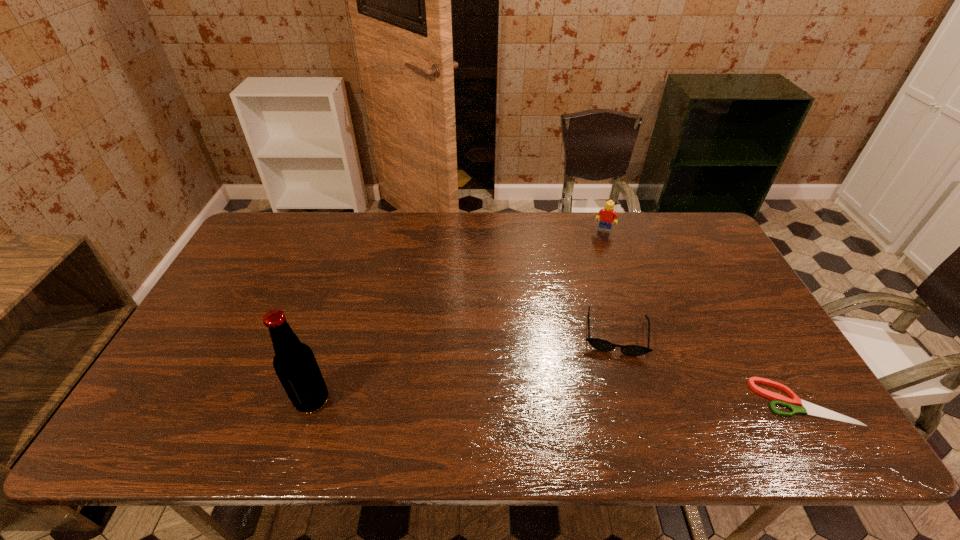
Locate an element on the screen. This screenshot has width=960, height=540. vacant space that is in between the third tallest object and the Lego is located at coordinates (610, 281).

Image resolution: width=960 pixels, height=540 pixels. Identify the location of free point between the beer bottle and the rightmost object. (558, 401).

Find the location of a particular element. The image size is (960, 540). unoccupied position between the Lego and the sunglasses is located at coordinates (610, 281).

Find the location of a particular element. free space between the scissors and the Lego is located at coordinates (704, 316).

This screenshot has width=960, height=540. I want to click on free space between the second tallest object and the third tallest object, so click(x=610, y=281).

Identify the location of the third closest object relative to the leftmost object. This screenshot has height=540, width=960. (794, 404).

Where is `object that stands as the second closest to the Lego`? Image resolution: width=960 pixels, height=540 pixels. object that stands as the second closest to the Lego is located at coordinates (794, 404).

Where is `vacant space that satisfies the following two spatial constraints: 1. on the back side of the sunglasses; 2. on the right side of the tallest object`? The width and height of the screenshot is (960, 540). vacant space that satisfies the following two spatial constraints: 1. on the back side of the sunglasses; 2. on the right side of the tallest object is located at coordinates (333, 333).

You are a GUI agent. You are given a task and a screenshot of the screen. Output one action in this format:
    pyautogui.click(x=<x>, y=<y>)
    Task: Click on the vacant space that satisfies the following two spatial constraints: 1. on the front side of the rightmost object; 2. on the right side of the tallest object
    
    Given the screenshot: What is the action you would take?
    pyautogui.click(x=311, y=402)

The height and width of the screenshot is (540, 960). I want to click on vacant region that satisfies the following two spatial constraints: 1. on the back side of the Lego; 2. on the right side of the tallest object, so click(x=366, y=230).